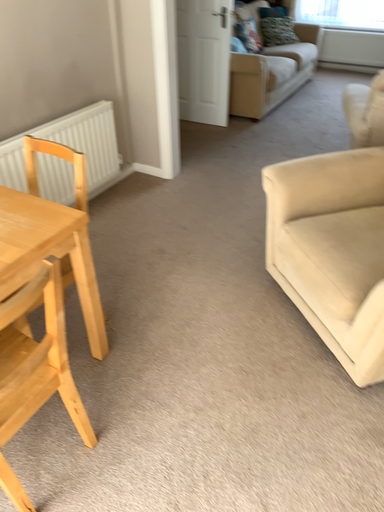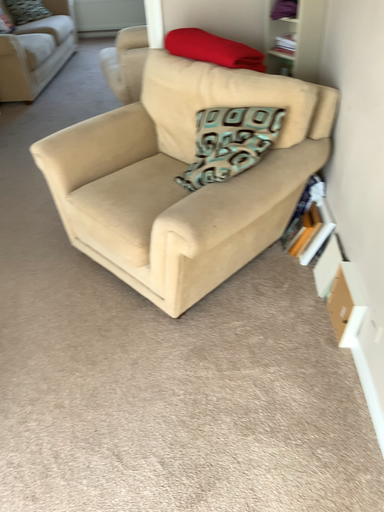
Question: How did the camera likely rotate when shooting the video?

Choices:
 (A) rotated left
 (B) rotated right

Answer: (B)